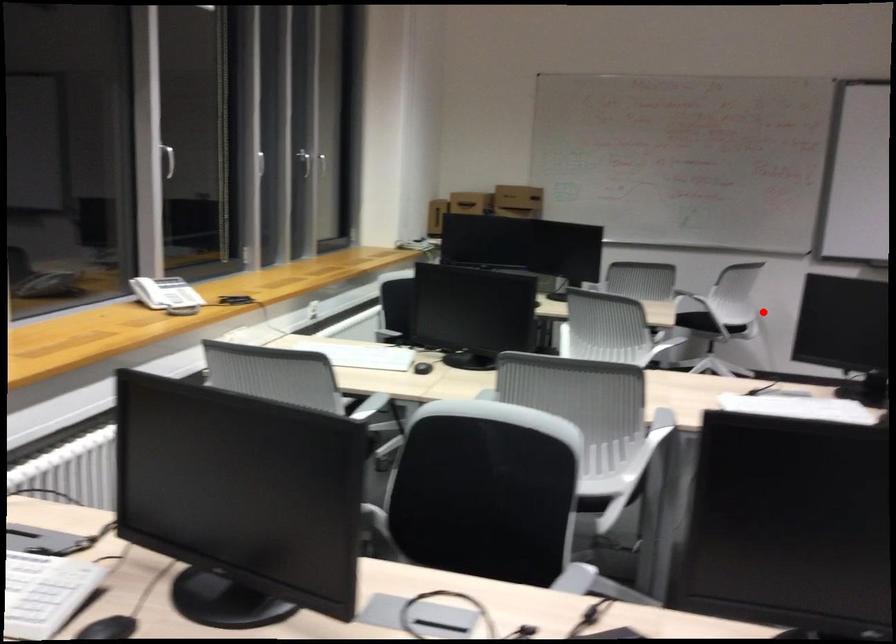
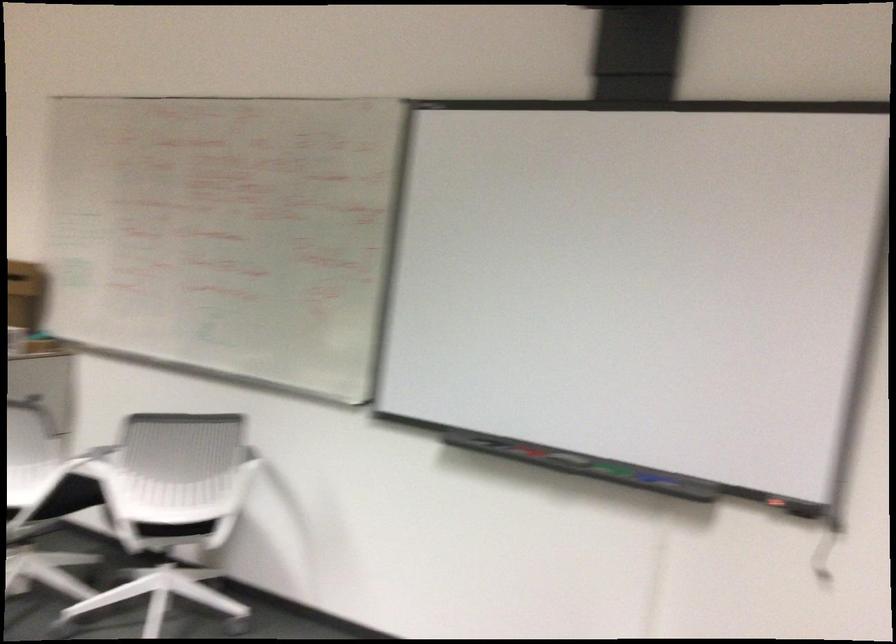
In the second image, find the point that corresponds to the highlighted location in the first image.

(175, 529)